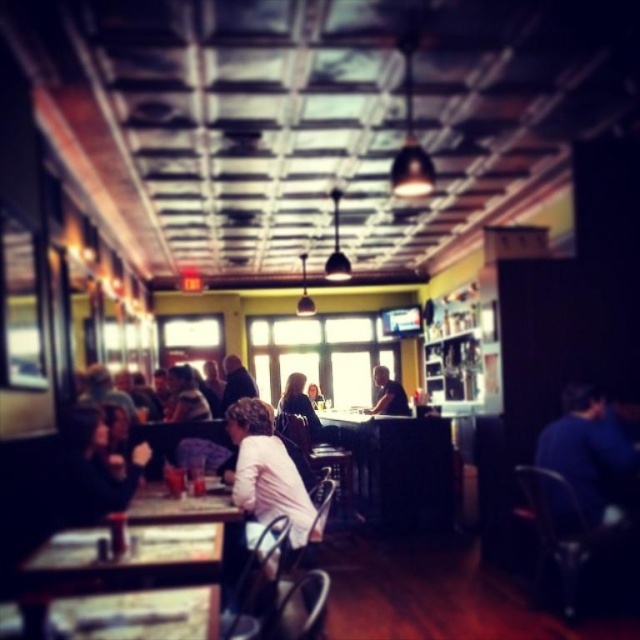
You are a customer entering the restaurant and see the white matte shirt at center and the dark brown leather jacket at lower left. Which item takes up more space in the scene?

The dark brown leather jacket at lower left takes up more space than the white matte shirt at center.

You are a customer sitting at a table in the center of the restaurant and you see both the dark blue sweater at center and the dark blue shirt at center. Which one is located to your right side?

The dark blue sweater at center is located to your right side since it is positioned to the right of the dark blue shirt at center.